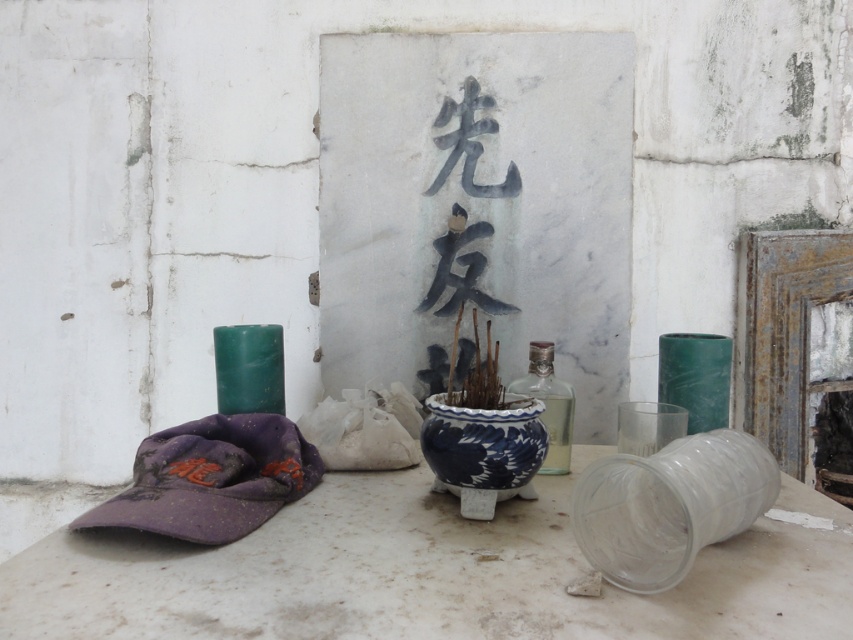
Is white marble table at center wider than transparent plastic cup at lower right?

Yes.

Is point (722, 548) closer to camera compared to point (682, 436)?

That is True.

Image resolution: width=853 pixels, height=640 pixels. I want to click on white marble table at center, so click(x=428, y=573).

Between rusty metal fireplace at right and blue porcelain pot at center, which one has more height?

rusty metal fireplace at right

Which of these two, rusty metal fireplace at right or blue porcelain pot at center, stands shorter?

blue porcelain pot at center

The width and height of the screenshot is (853, 640). Describe the element at coordinates (798, 353) in the screenshot. I see `rusty metal fireplace at right` at that location.

The height and width of the screenshot is (640, 853). Find the location of `rusty metal fireplace at right`. rusty metal fireplace at right is located at coordinates (798, 353).

Does transparent plastic cup at lower right have a smaller size compared to clear glass bottle at center?

Actually, transparent plastic cup at lower right might be larger than clear glass bottle at center.

Where is `transparent plastic cup at lower right`? transparent plastic cup at lower right is located at coordinates [x=669, y=506].

Where is `transparent plastic cup at lower right`? transparent plastic cup at lower right is located at coordinates point(669,506).